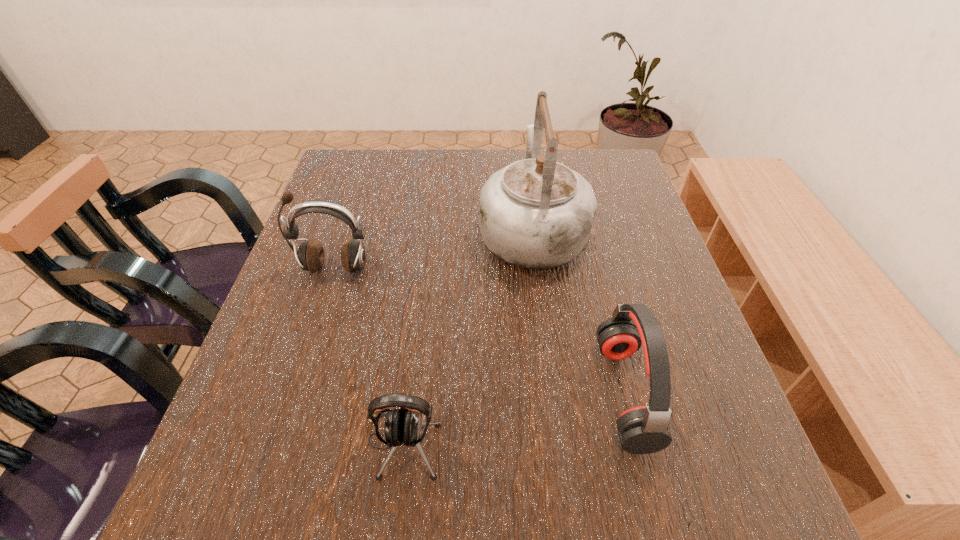
Locate an element on the screen. The height and width of the screenshot is (540, 960). the tallest object is located at coordinates (536, 213).

Locate an element on the screen. The height and width of the screenshot is (540, 960). the leftmost object is located at coordinates (311, 256).

This screenshot has width=960, height=540. Find the location of `the farthest earphone`. the farthest earphone is located at coordinates (311, 256).

You are a GUI agent. You are given a task and a screenshot of the screen. Output one action in this format:
    pyautogui.click(x=<x>, y=<y>)
    Task: Click on the rightmost earphone
    This screenshot has height=540, width=960.
    Given the screenshot: What is the action you would take?
    pyautogui.click(x=642, y=429)

You are a GUI agent. You are given a task and a screenshot of the screen. Output one action in this format:
    pyautogui.click(x=<x>, y=<y>)
    Task: Click on the second object from left to right
    The image size is (960, 540).
    Given the screenshot: What is the action you would take?
    pyautogui.click(x=402, y=426)

The height and width of the screenshot is (540, 960). What are the coordinates of `free space located 0.220m at the spout of the kettle` in the screenshot? It's located at (522, 150).

Locate an element on the screen. This screenshot has height=540, width=960. free space located at the spout of the kettle is located at coordinates (525, 175).

Where is `vacant space located 0.070m at the spout of the kettle`? Image resolution: width=960 pixels, height=540 pixels. vacant space located 0.070m at the spout of the kettle is located at coordinates (525, 177).

Where is `vacant space located 0.280m on the ear pads of the leftmost object`? The height and width of the screenshot is (540, 960). vacant space located 0.280m on the ear pads of the leftmost object is located at coordinates (293, 395).

I want to click on vacant space located on the ear cups of the rightmost earphone, so click(x=519, y=393).